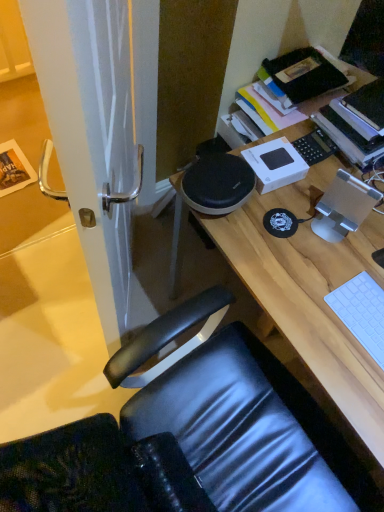
Question: Considering the relative sizes of hardcover book at upper right and white matte keyboard at lower right in the image provided, is hardcover book at upper right shorter than white matte keyboard at lower right?

Choices:
 (A) yes
 (B) no

Answer: (B)

Question: Is hardcover book at upper right not inside white matte keyboard at lower right?

Choices:
 (A) yes
 (B) no

Answer: (A)

Question: Is white matte keyboard at lower right surrounded by hardcover book at upper right?

Choices:
 (A) yes
 (B) no

Answer: (B)

Question: Is hardcover book at upper right facing away from white matte keyboard at lower right?

Choices:
 (A) no
 (B) yes

Answer: (A)

Question: Is hardcover book at upper right taller than white matte keyboard at lower right?

Choices:
 (A) yes
 (B) no

Answer: (A)

Question: Is the position of hardcover book at upper right less distant than that of white matte keyboard at lower right?

Choices:
 (A) yes
 (B) no

Answer: (B)

Question: Can you confirm if white glossy door handle at left is shorter than white matte keyboard at lower right?

Choices:
 (A) no
 (B) yes

Answer: (A)

Question: Is white glossy door handle at left directly adjacent to white matte keyboard at lower right?

Choices:
 (A) no
 (B) yes

Answer: (A)

Question: Is white glossy door handle at left positioned with its back to white matte keyboard at lower right?

Choices:
 (A) yes
 (B) no

Answer: (A)

Question: Is white glossy door handle at left facing towards white matte keyboard at lower right?

Choices:
 (A) no
 (B) yes

Answer: (A)

Question: Does white glossy door handle at left appear on the left side of white matte keyboard at lower right?

Choices:
 (A) no
 (B) yes

Answer: (B)

Question: From a real-world perspective, is white glossy door handle at left on top of white matte keyboard at lower right?

Choices:
 (A) yes
 (B) no

Answer: (B)

Question: Can we say white matte keyboard at lower right lies outside hardcover book at upper right?

Choices:
 (A) yes
 (B) no

Answer: (A)